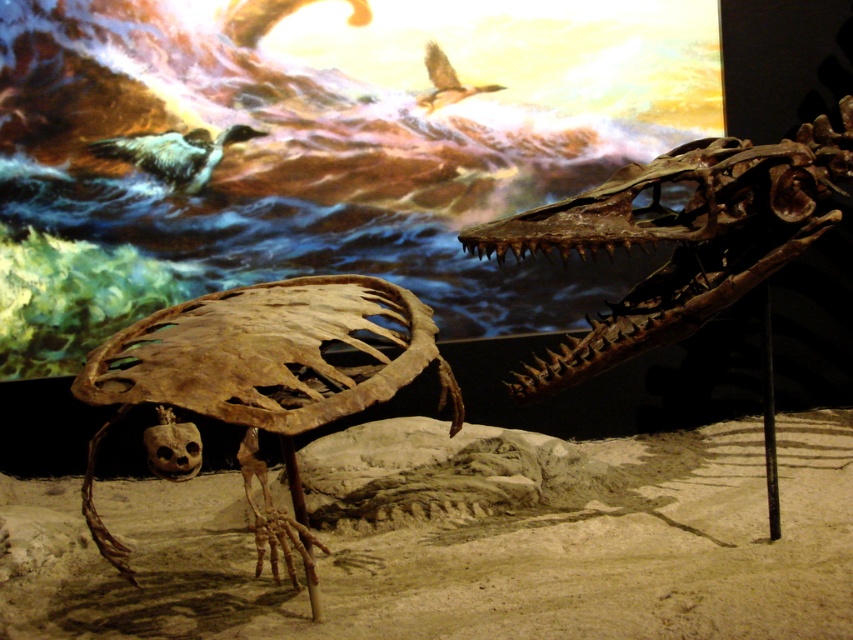
You are a paleontologist examining the museum display. You notice the brown bone fossil at lower left and the white feathered bird at upper left. Which object is wider?

The brown bone fossil at lower left might be wider than the white feathered bird at upper left.

You are a photographer standing in front of the plesiosaur fossil display. You want to take a photo of the white feathered bird at upper left without any obstructions. Is the camera close enough to capture the bird clearly?

The white feathered bird at upper left and camera are 13.94 feet apart from each other. Since the distance is within a typical camera lens range, the photographer can capture the bird clearly without any obstructions.